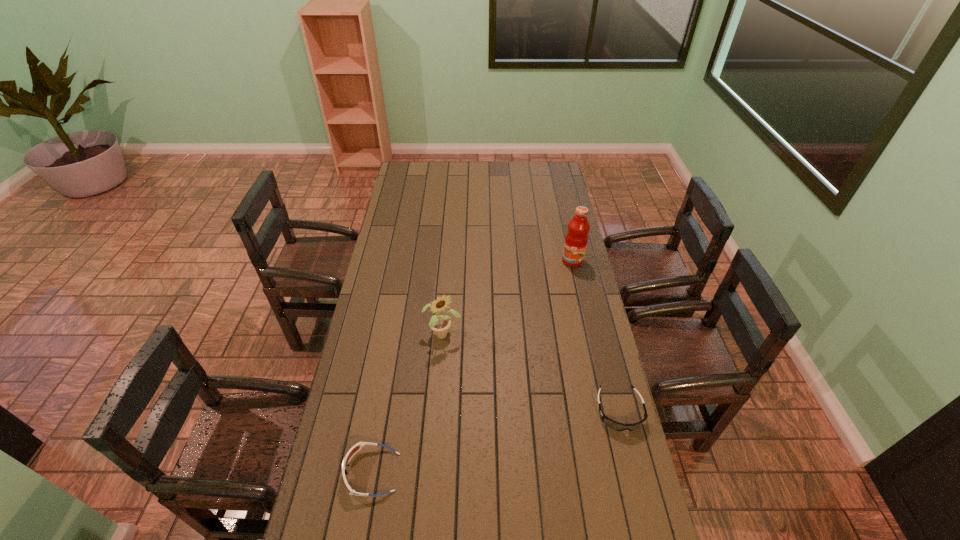
Where is `vacant space at the right edge of the desktop`? The width and height of the screenshot is (960, 540). vacant space at the right edge of the desktop is located at coordinates (564, 268).

Find the location of a particular element. Image resolution: width=960 pixels, height=540 pixels. vacant space at the far right corner of the desktop is located at coordinates (533, 167).

What are the coordinates of `vacant space that is in between the left goggles and the tallest object` in the screenshot? It's located at (472, 367).

Locate an element on the screen. The height and width of the screenshot is (540, 960). free space between the nearer goggles and the sunflower is located at coordinates (407, 403).

Where is `free space between the farthest object and the nearer goggles`? The image size is (960, 540). free space between the farthest object and the nearer goggles is located at coordinates (472, 367).

This screenshot has height=540, width=960. What are the coordinates of `empty location between the farthest object and the left goggles` in the screenshot? It's located at (472, 367).

Where is `free space between the third shortest object and the third tallest object`? The width and height of the screenshot is (960, 540). free space between the third shortest object and the third tallest object is located at coordinates (407, 403).

Locate an element on the screen. This screenshot has height=540, width=960. vacant area between the left goggles and the farthest object is located at coordinates (472, 367).

Locate an element on the screen. vacant point located between the third nearest object and the taller goggles is located at coordinates point(407,403).

Find the location of a particular element. Image resolution: width=960 pixels, height=540 pixels. vacant area that lies between the third nearest object and the nearest object is located at coordinates (407, 403).